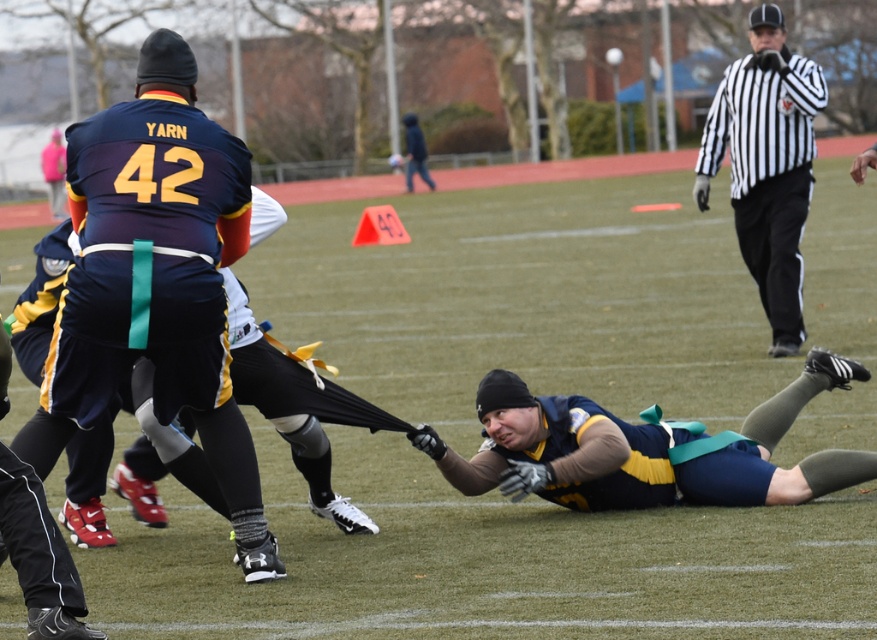
Is matte blue jersey at center bigger than black and white striped shirt at upper right?

Answer: Indeed, matte blue jersey at center has a larger size compared to black and white striped shirt at upper right.

From the picture: Between matte blue jersey at center and black and white striped shirt at upper right, which one has less height?

black and white striped shirt at upper right is shorter.

Does point (742, 474) lie behind point (760, 106)?

No, it is in front of (760, 106).

In order to click on matte blue jersey at center in this screenshot , I will do `click(646, 449)`.

How distant is matte blue jersey at center from dark blue jacket at upper center?

They are 23.63 meters apart.

Locate an element on the screen. This screenshot has height=640, width=877. matte blue jersey at center is located at coordinates (646, 449).

Which is behind, point (735, 230) or point (410, 122)?

The point (410, 122) is more distant.

Between black and white striped shirt at upper right and dark blue jacket at upper center, which one has less height?

Standing shorter between the two is black and white striped shirt at upper right.

Between point (750, 81) and point (431, 189), which one is positioned behind?

Point (431, 189)

You are a GUI agent. You are given a task and a screenshot of the screen. Output one action in this format:
    pyautogui.click(x=<x>, y=<y>)
    Task: Click on the black and white striped shirt at upper right
    The width and height of the screenshot is (877, 640).
    Given the screenshot: What is the action you would take?
    766,164